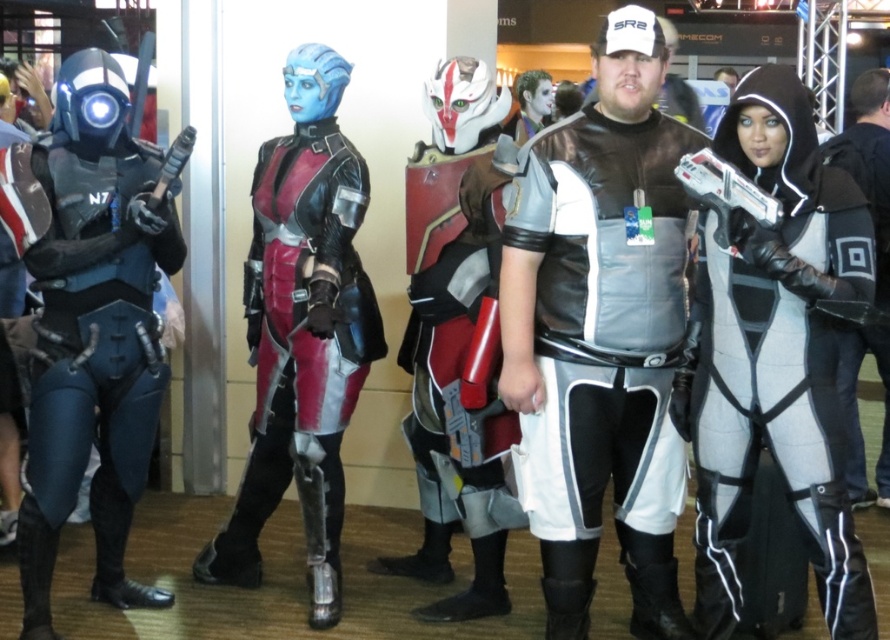
Is white matte bodysuit at center to the right of shiny silver armor at center from the viewer's perspective?

Yes, white matte bodysuit at center is to the right of shiny silver armor at center.

Does point (706, 536) come behind point (474, 445)?

No, (706, 536) is closer to viewer.

Locate an element on the screen. Image resolution: width=890 pixels, height=640 pixels. white matte bodysuit at center is located at coordinates (775, 358).

The width and height of the screenshot is (890, 640). I want to click on silver metallic armor at center, so click(601, 332).

In the scene shown: Which is more to the left, silver metallic armor at center or white matte bodysuit at center?

Positioned to the left is silver metallic armor at center.

Does point (637, 362) come in front of point (761, 172)?

No, (637, 362) is behind (761, 172).

Where is `silver metallic armor at center`? This screenshot has height=640, width=890. silver metallic armor at center is located at coordinates [601, 332].

Is matte black armor at left shorter than leather-like armor at center?

Yes, matte black armor at left is shorter than leather-like armor at center.

Between matte black armor at left and leather-like armor at center, which one is positioned higher?

leather-like armor at center

Locate an element on the screen. matte black armor at left is located at coordinates (94, 332).